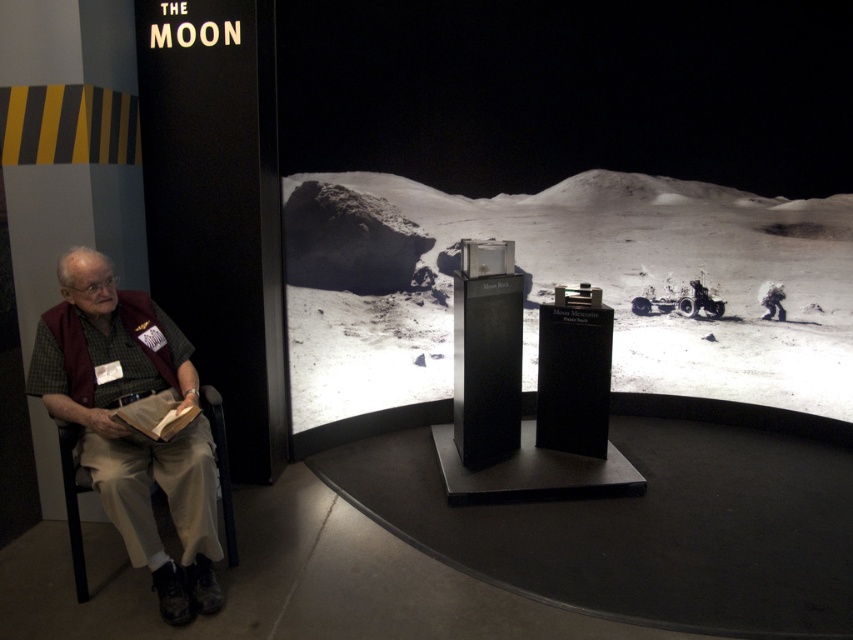
You are standing at the entrance of the exhibit and want to locate the beige fabric pants at left. According to the coordinates provided, where exactly should you look in the image to find them?

The beige fabric pants at left are located at coordinates point 0.667 on the x axis and 0.154 on the y axis.

You are standing in front of the Moon exhibit and want to touch the point at coordinates point (x=100, y=358). Can you reach it without moving your body?

The distance of point (x=100, y=358) from viewer is 2.56 meters, so you cannot reach it without moving your body since it is too far away.

You are standing in front of the large curved screen displaying the lunar surface scene. There are two points marked on the screen at coordinates point (207, 452) and point (114, 413). Which point is nearer to you?

Point (207, 452) is closer to the viewer than point (114, 413).